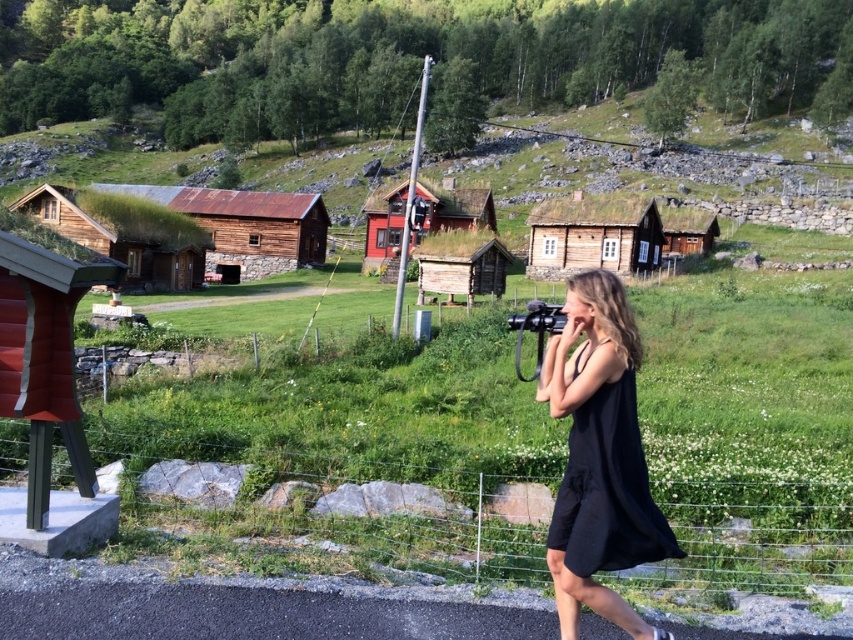
You are a delivery person trying to park your van on the paved road next to the wire mesh fence at lower center and the wooden log cabin at center. Can you fit your van between the two objects if the van is 2 meters wide?

The wire mesh fence at lower center is wider than the wooden log cabin at center. However, without knowing the exact width of the space between them, it is impossible to determine if the van will fit. Please check the actual distance between the two objects.

You are a hiker standing on the paved road and want to visit both the red wooden hut at center and the wooden log cabin at center. Which one should you approach first to reach the closer one?

The red wooden hut at center is closer to the viewer than the wooden log cabin at center, so you should approach the red wooden hut at center first.